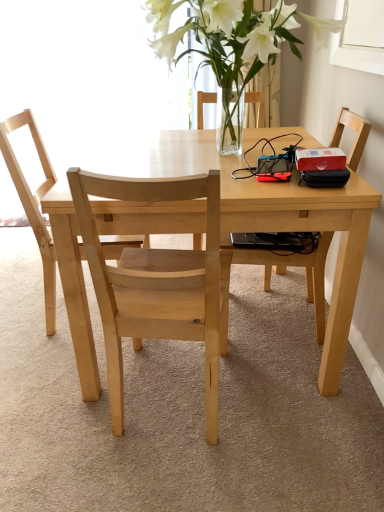
This screenshot has height=512, width=384. Find the location of `clear glass vase at upper center`. clear glass vase at upper center is located at coordinates (232, 39).

The width and height of the screenshot is (384, 512). In order to click on natural wood chair at center, the 1th chair viewed from the left in this screenshot , I will do `click(34, 204)`.

This screenshot has width=384, height=512. Describe the element at coordinates (158, 281) in the screenshot. I see `natural wood chair at center, which is the second chair from left to right` at that location.

Identify the location of light brown wooden chair at right, which ranks as the first chair in right-to-left order. (355, 131).

The height and width of the screenshot is (512, 384). What are the coordinates of `clear glass vase at upper center` in the screenshot? It's located at (232, 39).

In the scene shown: Who is smaller, light wood table at center or natural wood chair at center, the 3th chair from the right?

Smaller between the two is natural wood chair at center, the 3th chair from the right.

Based on their positions, is light wood table at center located to the left or right of natural wood chair at center, the 1th chair viewed from the left?

In the image, light wood table at center appears on the right side of natural wood chair at center, the 1th chair viewed from the left.

Considering the sizes of objects light wood table at center and natural wood chair at center, the 3th chair from the right, in the image provided, who is thinner, light wood table at center or natural wood chair at center, the 3th chair from the right,?

natural wood chair at center, the 3th chair from the right, is thinner.

Measure the distance between light wood table at center and natural wood chair at center, the 1th chair viewed from the left.

They are 14.23 inches apart.

How different are the orientations of light brown wooden chair at right, the third chair when ordered from left to right, and natural wood chair at center, which is the second chair from left to right, in degrees?

There is a 86.8-degree angle between the facing directions of light brown wooden chair at right, the third chair when ordered from left to right, and natural wood chair at center, which is the second chair from left to right.

Locate an element on the screen. The height and width of the screenshot is (512, 384). the 2nd chair below the light brown wooden chair at right, the third chair when ordered from left to right (from a real-world perspective) is located at coordinates (158, 281).

Is natural wood chair at center, which is the second chair from left to right, a part of light brown wooden chair at right, which ranks as the first chair in right-to-left order?

No, natural wood chair at center, which is the second chair from left to right, is not surrounded by light brown wooden chair at right, which ranks as the first chair in right-to-left order.

From the image's perspective, is light brown wooden chair at right, the third chair when ordered from left to right, positioned above or below natural wood chair at center, which is the second chair from left to right?

Clearly, from the image's perspective, light brown wooden chair at right, the third chair when ordered from left to right, is above natural wood chair at center, which is the second chair from left to right.

Is clear glass vase at upper center with natural wood chair at center, which is the second chair from left to right?

No, clear glass vase at upper center is not beside natural wood chair at center, which is the second chair from left to right.

Is clear glass vase at upper center in front of or behind natural wood chair at center, which is the second chair from left to right, in the image?

clear glass vase at upper center is positioned farther from the viewer than natural wood chair at center, which is the second chair from left to right.

Could you tell me if clear glass vase at upper center is turned towards natural wood chair at center, which is the second chair from left to right?

No, clear glass vase at upper center is not turned towards natural wood chair at center, which is the second chair from left to right.

Looking at this image, is natural wood chair at center, the 3th chair from the right, not near light wood table at center?

No, natural wood chair at center, the 3th chair from the right, is in close proximity to light wood table at center.

Considering the relative sizes of natural wood chair at center, the 1th chair viewed from the left, and light wood table at center in the image provided, is natural wood chair at center, the 1th chair viewed from the left, bigger than light wood table at center?

No.

From a real-world perspective, which is physically above, natural wood chair at center, the 3th chair from the right, or light wood table at center?

From a 3D spatial view, natural wood chair at center, the 3th chair from the right, is above.

Which object is positioned more to the left, natural wood chair at center, the 3th chair from the right, or light wood table at center?

From the viewer's perspective, natural wood chair at center, the 3th chair from the right, appears more on the left side.

Is natural wood chair at center, which is the second chair from left to right, taller than light brown wooden chair at right, the third chair when ordered from left to right?

In fact, natural wood chair at center, which is the second chair from left to right, may be shorter than light brown wooden chair at right, the third chair when ordered from left to right.

Where is `chair below the light brown wooden chair at right, the third chair when ordered from left to right (from the image's perspective)`? Image resolution: width=384 pixels, height=512 pixels. chair below the light brown wooden chair at right, the third chair when ordered from left to right (from the image's perspective) is located at coordinates (158, 281).

Considering the positions of objects natural wood chair at center, which appears as the 2th chair when viewed from the right, and light brown wooden chair at right, the third chair when ordered from left to right, in the image provided, who is more to the left, natural wood chair at center, which appears as the 2th chair when viewed from the right, or light brown wooden chair at right, the third chair when ordered from left to right,?

Positioned to the left is natural wood chair at center, which appears as the 2th chair when viewed from the right.

In terms of size, does natural wood chair at center, which is the second chair from left to right, appear bigger or smaller than light brown wooden chair at right, which ranks as the first chair in right-to-left order?

Considering their sizes, natural wood chair at center, which is the second chair from left to right, takes up less space than light brown wooden chair at right, which ranks as the first chair in right-to-left order.

Based on the photo, considering the sizes of objects natural wood chair at center, which appears as the 2th chair when viewed from the right, and natural wood chair at center, the 1th chair viewed from the left, in the image provided, who is wider, natural wood chair at center, which appears as the 2th chair when viewed from the right, or natural wood chair at center, the 1th chair viewed from the left,?

natural wood chair at center, which appears as the 2th chair when viewed from the right, is wider.

Looking at this image, considering the relative sizes of natural wood chair at center, which appears as the 2th chair when viewed from the right, and natural wood chair at center, the 3th chair from the right, in the image provided, is natural wood chair at center, which appears as the 2th chair when viewed from the right, smaller than natural wood chair at center, the 3th chair from the right,?

Indeed, natural wood chair at center, which appears as the 2th chair when viewed from the right, has a smaller size compared to natural wood chair at center, the 3th chair from the right.

From a real-world perspective, does natural wood chair at center, which is the second chair from left to right, stand above natural wood chair at center, the 3th chair from the right?

No, from a real-world perspective, natural wood chair at center, which is the second chair from left to right, is not on top of natural wood chair at center, the 3th chair from the right.

Could you tell me if natural wood chair at center, which appears as the 2th chair when viewed from the right, is turned towards natural wood chair at center, the 3th chair from the right?

No, natural wood chair at center, which appears as the 2th chair when viewed from the right, is not turned towards natural wood chair at center, the 3th chair from the right.

Is natural wood chair at center, the 1th chair viewed from the left, positioned with its back to light brown wooden chair at right, which ranks as the first chair in right-to-left order?

natural wood chair at center, the 1th chair viewed from the left, does not have its back to light brown wooden chair at right, which ranks as the first chair in right-to-left order.

Considering the relative sizes of natural wood chair at center, the 3th chair from the right, and light brown wooden chair at right, which ranks as the first chair in right-to-left order, in the image provided, is natural wood chair at center, the 3th chair from the right, taller than light brown wooden chair at right, which ranks as the first chair in right-to-left order,?

Incorrect, the height of natural wood chair at center, the 3th chair from the right, is not larger of that of light brown wooden chair at right, which ranks as the first chair in right-to-left order.

Is natural wood chair at center, the 3th chair from the right, at the right side of light brown wooden chair at right, which ranks as the first chair in right-to-left order?

In fact, natural wood chair at center, the 3th chair from the right, is to the left of light brown wooden chair at right, which ranks as the first chair in right-to-left order.

From the image's perspective, between natural wood chair at center, the 3th chair from the right, and light brown wooden chair at right, which ranks as the first chair in right-to-left order, who is located below?

light brown wooden chair at right, which ranks as the first chair in right-to-left order, appears lower in the image.

Find the location of a particular element. chair that is the 2nd one when counting backward from the light wood table at center is located at coordinates (34, 204).

Find the location of a particular element. Image resolution: width=384 pixels, height=512 pixels. chair that is below the light brown wooden chair at right, which ranks as the first chair in right-to-left order (from the image's perspective) is located at coordinates (158, 281).

Looking at the image, which one is located closer to light wood table at center, light brown wooden chair at right, the third chair when ordered from left to right, or natural wood chair at center, which appears as the 2th chair when viewed from the right?

The object closer to light wood table at center is natural wood chair at center, which appears as the 2th chair when viewed from the right.

Based on their spatial positions, is natural wood chair at center, which is the second chair from left to right, or light wood table at center closer to clear glass vase at upper center?

light wood table at center is closer to clear glass vase at upper center.

Consider the image. From the image, which object appears to be nearer to light brown wooden chair at right, which ranks as the first chair in right-to-left order, light wood table at center or natural wood chair at center, the 3th chair from the right?

light wood table at center is positioned closer to the anchor light brown wooden chair at right, which ranks as the first chair in right-to-left order.

Looking at the image, which one is located closer to light brown wooden chair at right, the third chair when ordered from left to right, natural wood chair at center, which is the second chair from left to right, or natural wood chair at center, the 3th chair from the right?

natural wood chair at center, which is the second chair from left to right, is positioned closer to the anchor light brown wooden chair at right, the third chair when ordered from left to right.

Based on their spatial positions, is natural wood chair at center, which appears as the 2th chair when viewed from the right, or light brown wooden chair at right, the third chair when ordered from left to right, closer to natural wood chair at center, the 1th chair viewed from the left?

natural wood chair at center, which appears as the 2th chair when viewed from the right, lies closer to natural wood chair at center, the 1th chair viewed from the left, than the other object.

From the image, which object appears to be farther from natural wood chair at center, the 1th chair viewed from the left, clear glass vase at upper center or light brown wooden chair at right, the third chair when ordered from left to right?

The object further to natural wood chair at center, the 1th chair viewed from the left, is light brown wooden chair at right, the third chair when ordered from left to right.

From the image, which object appears to be farther from light wood table at center, light brown wooden chair at right, which ranks as the first chair in right-to-left order, or clear glass vase at upper center?

light brown wooden chair at right, which ranks as the first chair in right-to-left order, is further to light wood table at center.

Considering their positions, is light wood table at center positioned further to natural wood chair at center, the 3th chair from the right, than natural wood chair at center, which appears as the 2th chair when viewed from the right?

Among the two, light wood table at center is located further to natural wood chair at center, the 3th chair from the right.

Image resolution: width=384 pixels, height=512 pixels. I want to click on chair located between natural wood chair at center, the 3th chair from the right, and light brown wooden chair at right, the third chair when ordered from left to right, in the left-right direction, so click(x=158, y=281).

You are a GUI agent. You are given a task and a screenshot of the screen. Output one action in this format:
    pyautogui.click(x=<x>, y=<y>)
    Task: Click on the chair between natural wood chair at center, the 3th chair from the right, and light wood table at center
    
    Given the screenshot: What is the action you would take?
    pyautogui.click(x=158, y=281)

At what (x,y) coordinates should I click in order to perform the action: click on kitchen & dining room table between natural wood chair at center, the 3th chair from the right, and light brown wooden chair at right, which ranks as the first chair in right-to-left order, from left to right. Please return your answer as a coordinate pair (x, y). The image size is (384, 512). Looking at the image, I should click on (261, 213).

Identify the location of kitchen & dining room table between natural wood chair at center, which appears as the 2th chair when viewed from the right, and light brown wooden chair at right, the third chair when ordered from left to right, in the horizontal direction. (261, 213).